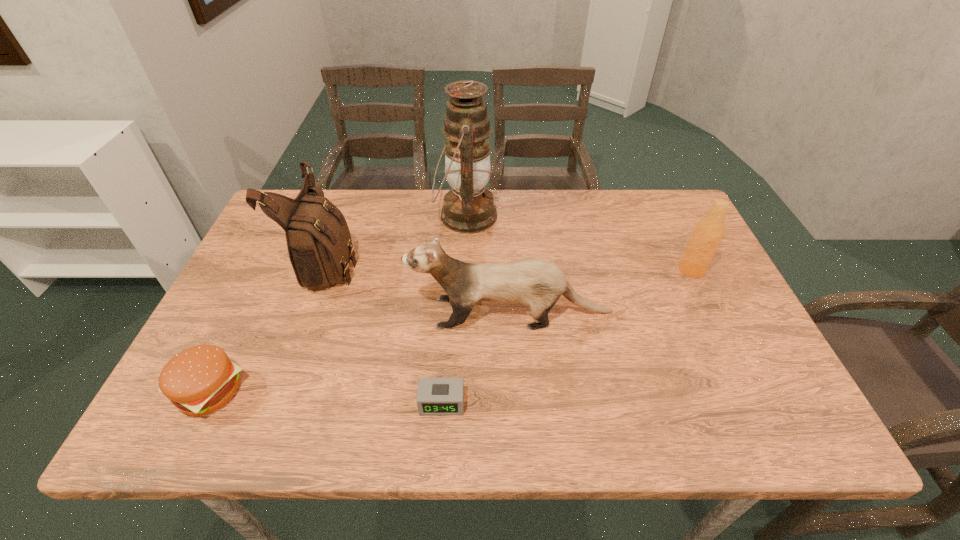
Find the location of a particular element. Image resolution: width=960 pixels, height=540 pixels. free space located on the face of the ferret is located at coordinates (298, 313).

Locate an element on the screen. This screenshot has height=540, width=960. free location located on the face of the ferret is located at coordinates (252, 313).

At what (x,y) coordinates should I click in order to perform the action: click on vacant space located on the right of the second shortest object. Please return your answer as a coordinate pair (x, y). The height and width of the screenshot is (540, 960). Looking at the image, I should click on (367, 391).

Locate an element on the screen. lantern located at the far edge is located at coordinates (x=468, y=208).

Identify the location of shoulder bag located at the far edge. (319, 243).

Find the location of a particular element. The height and width of the screenshot is (540, 960). hamburger that is at the near edge is located at coordinates (199, 380).

Find the location of a particular element. alarm clock that is at the near edge is located at coordinates (436, 396).

Find the location of a particular element. The height and width of the screenshot is (540, 960). shoulder bag that is positioned at the left edge is located at coordinates (319, 243).

You are a GUI agent. You are given a task and a screenshot of the screen. Output one action in this format:
    pyautogui.click(x=<x>, y=<y>)
    Task: Click on the hamburger that is at the left edge
    
    Given the screenshot: What is the action you would take?
    pyautogui.click(x=199, y=380)

Locate an element on the screen. object that is positioned at the right edge is located at coordinates (708, 233).